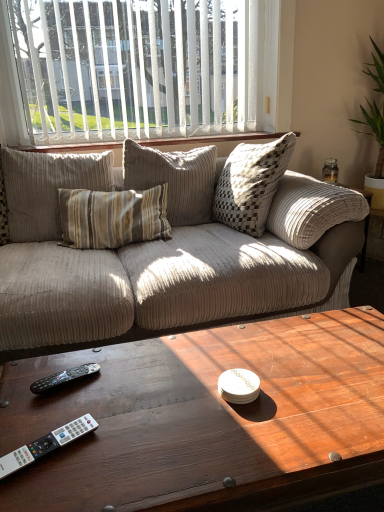
What is the approximate width of wooden at upper center?

22.43 centimeters.

What do you see at coordinates (46, 445) in the screenshot? I see `white plastic remote control at lower left, which ranks as the 2th remote control in back-to-front order` at bounding box center [46, 445].

In order to face black plastic remote control at lower left, the 2th remote control in the front-to-back sequence, should I rotate leftwards or rightwards?

Turn left approximately 16.408 degrees to face it.

Find the location of a particular element. Image resolution: width=384 pixels, height=512 pixels. wooden at upper center is located at coordinates (212, 141).

Considering the positions of points (66, 438) and (43, 163), is point (66, 438) farther from camera compared to point (43, 163)?

No, it is not.

From the image's perspective, is white plastic remote control at lower left, arranged as the 2th remote control when viewed from the top, located above or below beige corduroy pillow at center?

From the image's perspective, white plastic remote control at lower left, arranged as the 2th remote control when viewed from the top, appears below beige corduroy pillow at center.

Which object is closer to the camera taking this photo, white plastic remote control at lower left, arranged as the 2th remote control when viewed from the top, or beige corduroy pillow at center?

white plastic remote control at lower left, arranged as the 2th remote control when viewed from the top, is more forward.

From a real-world perspective, is black plastic remote control at lower left, placed as the 1th remote control when sorted from top to bottom, positioned under white plastic remote control at lower left, which is counted as the first remote control, starting from the bottom, based on gravity?

Yes, from a real-world perspective, black plastic remote control at lower left, placed as the 1th remote control when sorted from top to bottom, is beneath white plastic remote control at lower left, which is counted as the first remote control, starting from the bottom.

Would you say black plastic remote control at lower left, the 2th remote control in the front-to-back sequence, is outside white plastic remote control at lower left, marked as the 1th remote control in a front-to-back arrangement?

Yes, black plastic remote control at lower left, the 2th remote control in the front-to-back sequence, is not within white plastic remote control at lower left, marked as the 1th remote control in a front-to-back arrangement.

Does black plastic remote control at lower left, which is the second remote control from bottom to top, have a larger size compared to white plastic remote control at lower left, marked as the 1th remote control in a front-to-back arrangement?

Correct, black plastic remote control at lower left, which is the second remote control from bottom to top, is larger in size than white plastic remote control at lower left, marked as the 1th remote control in a front-to-back arrangement.

Can you tell me how much white vertical blinds at upper center and wooden at upper center differ in facing direction?

They differ by 0.0137 degrees in their facing directions.

From a real-world perspective, between white vertical blinds at upper center and wooden at upper center, who is vertically lower?

wooden at upper center is physically lower.

Is white vertical blinds at upper center facing towards wooden at upper center?

No, white vertical blinds at upper center is not turned towards wooden at upper center.

Is white vertical blinds at upper center taller or shorter than wooden at upper center?

white vertical blinds at upper center is taller than wooden at upper center.

From the picture: Do you think white vertical blinds at upper center is within black plastic remote control at lower left, which is the second remote control from bottom to top, or outside of it?

white vertical blinds at upper center is spatially situated outside black plastic remote control at lower left, which is the second remote control from bottom to top.

Does white vertical blinds at upper center have a lesser width compared to black plastic remote control at lower left, which appears as the 1th remote control when viewed from the back?

Indeed, white vertical blinds at upper center has a lesser width compared to black plastic remote control at lower left, which appears as the 1th remote control when viewed from the back.

Considering the positions of objects white vertical blinds at upper center and black plastic remote control at lower left, which appears as the 1th remote control when viewed from the back, in the image provided, who is in front, white vertical blinds at upper center or black plastic remote control at lower left, which appears as the 1th remote control when viewed from the back,?

black plastic remote control at lower left, which appears as the 1th remote control when viewed from the back, is closer to the camera.

Considering the relative sizes of white vertical blinds at upper center and black plastic remote control at lower left, which appears as the 1th remote control when viewed from the back, in the image provided, is white vertical blinds at upper center bigger than black plastic remote control at lower left, which appears as the 1th remote control when viewed from the back,?

Yes, white vertical blinds at upper center is bigger than black plastic remote control at lower left, which appears as the 1th remote control when viewed from the back.

From the picture: In the image, is wooden at upper center on the left side or the right side of wooden coffee table at center?

Based on their positions, wooden at upper center is located to the left of wooden coffee table at center.

Measure the distance between wooden at upper center and wooden coffee table at center.

They are 1.52 meters apart.

Is wooden at upper center directly adjacent to wooden coffee table at center?

wooden at upper center and wooden coffee table at center are not in contact.

Who is taller, wooden at upper center or wooden coffee table at center?

wooden coffee table at center is taller.

How different are the orientations of beige corduroy pillow at center and white vertical blinds at upper center in degrees?

2.1 degrees separate the facing orientations of beige corduroy pillow at center and white vertical blinds at upper center.

Would you say beige corduroy pillow at center is inside or outside white vertical blinds at upper center?

beige corduroy pillow at center is located beyond the bounds of white vertical blinds at upper center.

Considering the points (32, 229) and (234, 30), which point is in front, point (32, 229) or point (234, 30)?

The point (32, 229) is more forward.

Between beige corduroy pillow at center and white vertical blinds at upper center, which one has less height?

Standing shorter between the two is beige corduroy pillow at center.

From the image's perspective, which one is positioned lower, white vertical blinds at upper center or wooden coffee table at center?

wooden coffee table at center is shown below in the image.

Does white vertical blinds at upper center have a smaller size compared to wooden coffee table at center?

Yes.

Is wooden coffee table at center a part of white vertical blinds at upper center?

No, white vertical blinds at upper center does not contain wooden coffee table at center.

Which object is thinner, white vertical blinds at upper center or wooden coffee table at center?

With smaller width is white vertical blinds at upper center.

Locate an element on the screen. This screenshot has width=384, height=512. pillow above the white plastic remote control at lower left, which ranks as the 2th remote control in back-to-front order (from the image's perspective) is located at coordinates (47, 188).

Locate an element on the screen. remote control on the left of white plastic remote control at lower left, which is counted as the first remote control, starting from the bottom is located at coordinates [63, 378].

Based on the photo, when comparing their distances from wooden coffee table at center, does beige corduroy pillow at center or white plastic remote control at lower left, which is counted as the first remote control, starting from the bottom, seem closer?

white plastic remote control at lower left, which is counted as the first remote control, starting from the bottom, is positioned closer to the anchor wooden coffee table at center.

Looking at the image, which one is located closer to wooden at upper center, wooden coffee table at center or white vertical blinds at upper center?

white vertical blinds at upper center is positioned closer to the anchor wooden at upper center.

From the image, which object appears to be farther from white vertical blinds at upper center, wooden coffee table at center or white plastic remote control at lower left, arranged as the 2th remote control when viewed from the top?

white plastic remote control at lower left, arranged as the 2th remote control when viewed from the top, is further to white vertical blinds at upper center.

Estimate the real-world distances between objects in this image. Which object is closer to wooden coffee table at center, white vertical blinds at upper center or beige corduroy pillow at center?

Among the two, beige corduroy pillow at center is located nearer to wooden coffee table at center.

When comparing their distances from white plastic remote control at lower left, arranged as the 2th remote control when viewed from the top, does black plastic remote control at lower left, which appears as the 1th remote control when viewed from the back, or white vertical blinds at upper center seem closer?

black plastic remote control at lower left, which appears as the 1th remote control when viewed from the back, is closer to white plastic remote control at lower left, arranged as the 2th remote control when viewed from the top.

Which object lies nearer to the anchor point beige corduroy pillow at center, wooden coffee table at center or white plastic remote control at lower left, marked as the 1th remote control in a front-to-back arrangement?

Based on the image, wooden coffee table at center appears to be nearer to beige corduroy pillow at center.

From the image, which object appears to be nearer to white plastic remote control at lower left, which is counted as the first remote control, starting from the bottom, beige corduroy pillow at center or wooden at upper center?

beige corduroy pillow at center is closer to white plastic remote control at lower left, which is counted as the first remote control, starting from the bottom.

Based on their spatial positions, is beige corduroy pillow at center or white plastic remote control at lower left, which ranks as the 2th remote control in back-to-front order, closer to wooden at upper center?

Based on the image, beige corduroy pillow at center appears to be nearer to wooden at upper center.

At what (x,y) coordinates should I click in order to perform the action: click on remote control between white plastic remote control at lower left, which ranks as the 2th remote control in back-to-front order, and wooden at upper center from front to back. Please return your answer as a coordinate pair (x, y). Looking at the image, I should click on (63, 378).

The width and height of the screenshot is (384, 512). Find the location of `remote control between black plastic remote control at lower left, the 2th remote control in the front-to-back sequence, and wooden coffee table at center, in the horizontal direction`. remote control between black plastic remote control at lower left, the 2th remote control in the front-to-back sequence, and wooden coffee table at center, in the horizontal direction is located at coordinates (46, 445).

Locate an element on the screen. The image size is (384, 512). pillow that lies between white vertical blinds at upper center and wooden coffee table at center from top to bottom is located at coordinates (47, 188).

The height and width of the screenshot is (512, 384). What are the coordinates of `window sill between white vertical blinds at upper center and black plastic remote control at lower left, the 2th remote control in the front-to-back sequence, in the up-down direction` in the screenshot? It's located at (212, 141).